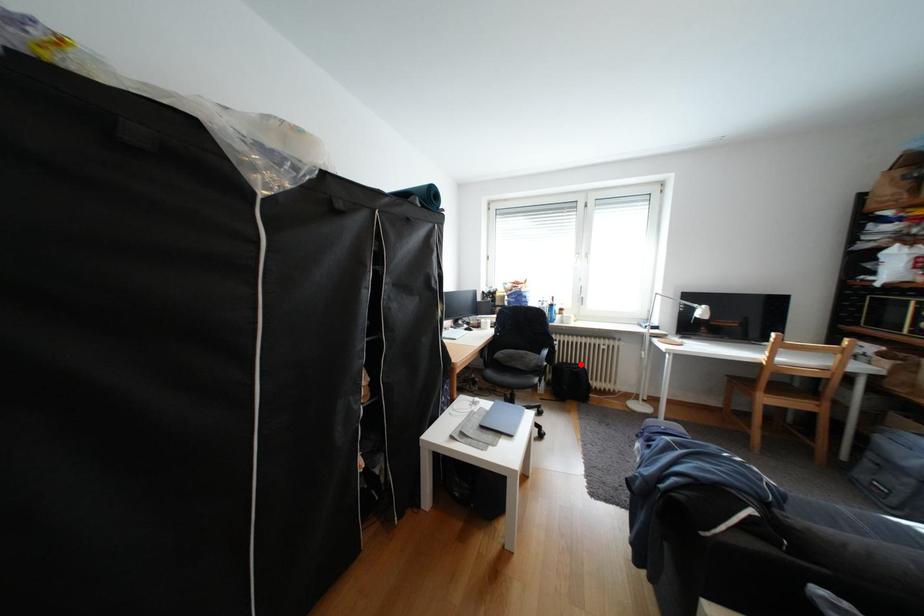
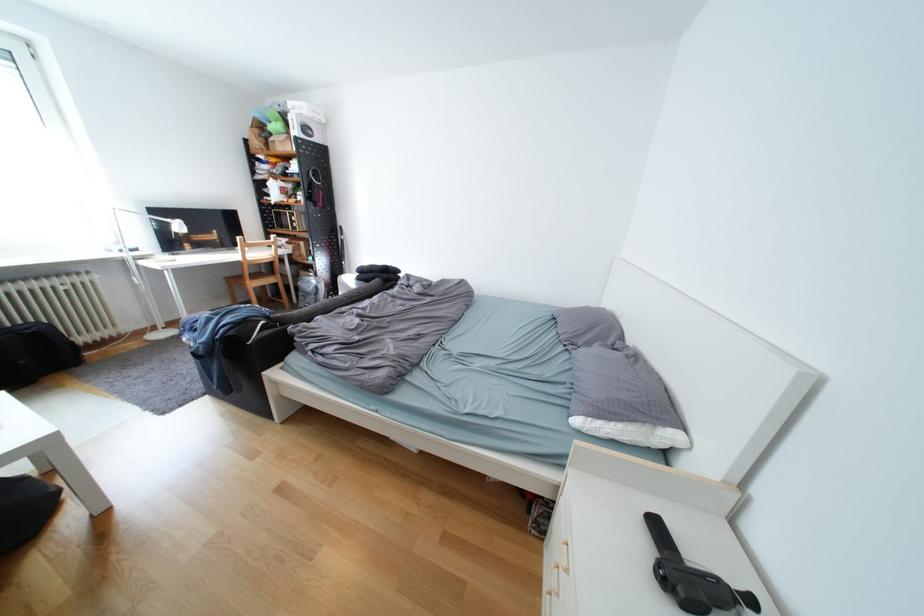
Question: I am providing you with two images of the same scene from different viewpoints. A red point is marked on the first image. Can you still see the location of the red point in image 2?

Choices:
 (A) Yes
 (B) No

Answer: (A)